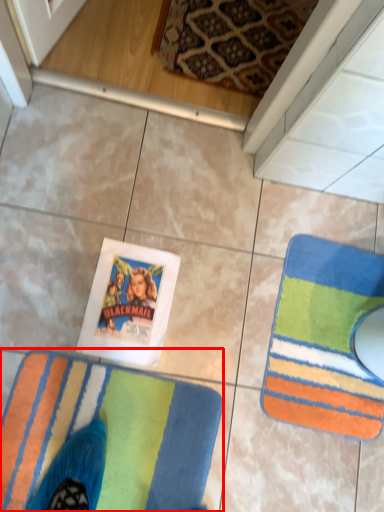
Question: Considering the relative positions of towel (annotated by the red box) and towel in the image provided, where is towel (annotated by the red box) located with respect to the staircase?

Choices:
 (A) left
 (B) right

Answer: (A)